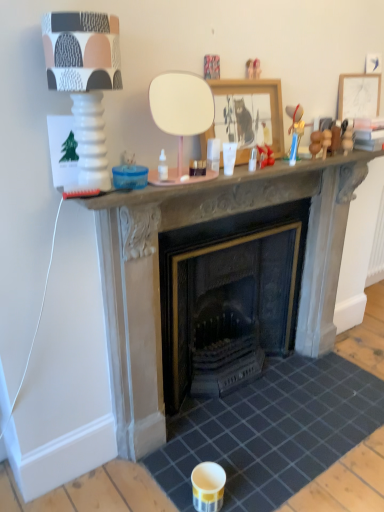
Question: Considering the relative sizes of wooden framed picture at center, which ranks as the 2th picture frame in back-to-front order, and matte white lamp at upper left in the image provided, is wooden framed picture at center, which ranks as the 2th picture frame in back-to-front order, smaller than matte white lamp at upper left?

Choices:
 (A) yes
 (B) no

Answer: (A)

Question: Does wooden framed picture at center, which appears as the 2th picture frame when viewed from the right, come behind matte white lamp at upper left?

Choices:
 (A) no
 (B) yes

Answer: (B)

Question: From a real-world perspective, is wooden framed picture at center, which appears as the 2th picture frame when viewed from the right, located higher than matte white lamp at upper left?

Choices:
 (A) yes
 (B) no

Answer: (B)

Question: Is wooden framed picture at center, which appears as the 2th picture frame when viewed from the right, to the right of matte white lamp at upper left from the viewer's perspective?

Choices:
 (A) yes
 (B) no

Answer: (A)

Question: From the image's perspective, is wooden framed picture at center, which appears as the first picture frame when viewed from the left, above matte white lamp at upper left?

Choices:
 (A) no
 (B) yes

Answer: (B)

Question: Is wooden framed picture at center, which ranks as the 2th picture frame in back-to-front order, next to matte white lamp at upper left?

Choices:
 (A) yes
 (B) no

Answer: (B)

Question: Is dark gray tile at center directly adjacent to wooden framed picture at center, which appears as the first picture frame when viewed from the front?

Choices:
 (A) no
 (B) yes

Answer: (A)

Question: Considering the relative positions of dark gray tile at center and wooden framed picture at center, which appears as the 2th picture frame when viewed from the right, in the image provided, is dark gray tile at center to the right of wooden framed picture at center, which appears as the 2th picture frame when viewed from the right, from the viewer's perspective?

Choices:
 (A) yes
 (B) no

Answer: (A)

Question: Is dark gray tile at center closer to the viewer compared to wooden framed picture at center, which appears as the first picture frame when viewed from the front?

Choices:
 (A) no
 (B) yes

Answer: (B)

Question: Considering the relative sizes of dark gray tile at center and wooden framed picture at center, which ranks as the 2th picture frame in back-to-front order, in the image provided, is dark gray tile at center bigger than wooden framed picture at center, which ranks as the 2th picture frame in back-to-front order,?

Choices:
 (A) no
 (B) yes

Answer: (B)

Question: Is dark gray tile at center not near wooden framed picture at center, which appears as the first picture frame when viewed from the left?

Choices:
 (A) no
 (B) yes

Answer: (B)

Question: Is wooden framed picture at center, which appears as the 2th picture frame when viewed from the right, completely or partially inside dark gray tile at center?

Choices:
 (A) yes
 (B) no

Answer: (B)

Question: Can you confirm if stone fireplace at center is positioned to the left of matte white lamp at upper left?

Choices:
 (A) yes
 (B) no

Answer: (B)